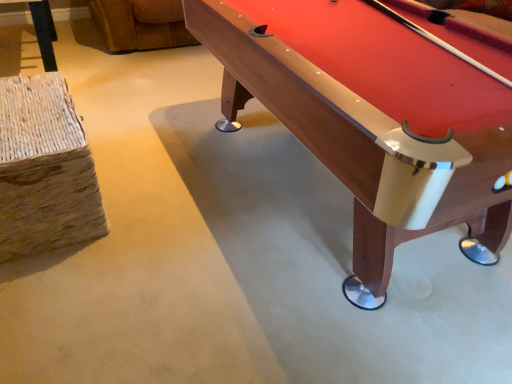
Question: Could you tell me if woven straw stool at left is facing wooden pool table at right?

Choices:
 (A) no
 (B) yes

Answer: (B)

Question: From a real-world perspective, is woven straw stool at left positioned over wooden pool table at right based on gravity?

Choices:
 (A) yes
 (B) no

Answer: (B)

Question: Is woven straw stool at left not inside wooden pool table at right?

Choices:
 (A) yes
 (B) no

Answer: (A)

Question: Can you confirm if woven straw stool at left is shorter than wooden pool table at right?

Choices:
 (A) no
 (B) yes

Answer: (B)

Question: Does woven straw stool at left have a greater width compared to wooden pool table at right?

Choices:
 (A) yes
 (B) no

Answer: (B)

Question: Considering the relative positions of woven straw stool at left and wooden pool table at right in the image provided, is woven straw stool at left to the left of wooden pool table at right from the viewer's perspective?

Choices:
 (A) no
 (B) yes

Answer: (B)

Question: Is woven straw stool at left a part of wooden pool table at right?

Choices:
 (A) no
 (B) yes

Answer: (A)

Question: Can you confirm if wooden pool table at right is smaller than woven straw stool at left?

Choices:
 (A) yes
 (B) no

Answer: (B)

Question: Is wooden pool table at right bigger than woven straw stool at left?

Choices:
 (A) no
 (B) yes

Answer: (B)

Question: Considering the relative sizes of wooden pool table at right and woven straw stool at left in the image provided, is wooden pool table at right thinner than woven straw stool at left?

Choices:
 (A) no
 (B) yes

Answer: (A)

Question: Is wooden pool table at right not close to woven straw stool at left?

Choices:
 (A) yes
 (B) no

Answer: (B)

Question: Is wooden pool table at right turned away from woven straw stool at left?

Choices:
 (A) no
 (B) yes

Answer: (B)

Question: Is wooden pool table at right spatially inside woven straw stool at left, or outside of it?

Choices:
 (A) outside
 (B) inside

Answer: (A)